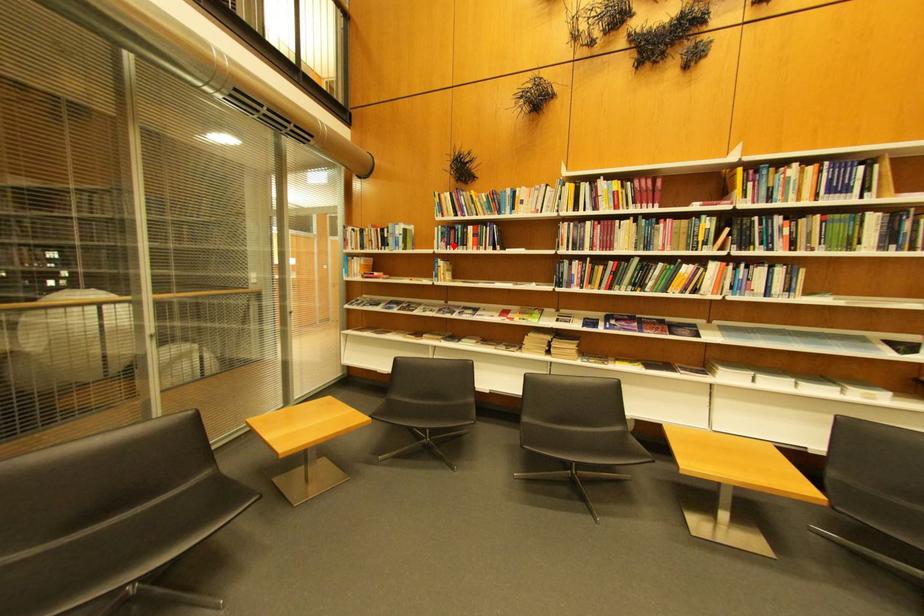
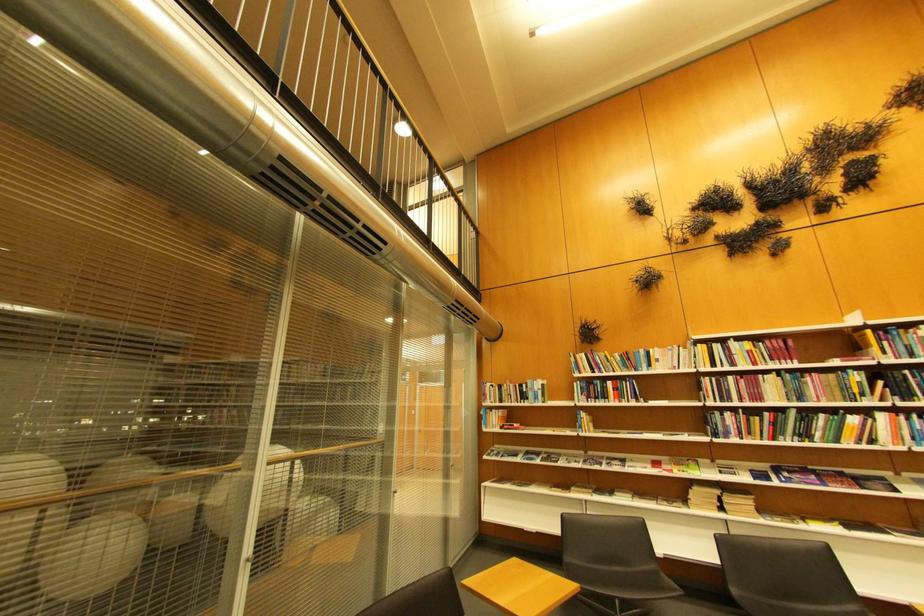
Locate, in the second image, the point that corresponds to the highlighted location in the first image.

(594, 399)